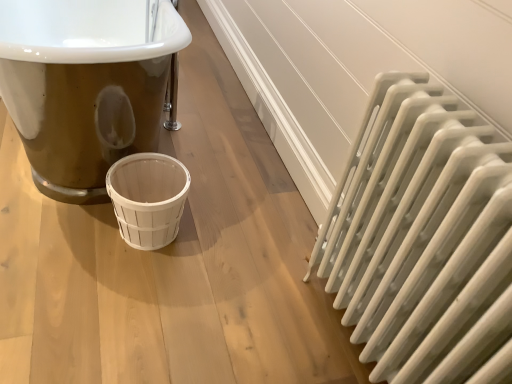
Question: Is white matte radiator at right inside or outside of white wood basket at center?

Choices:
 (A) outside
 (B) inside

Answer: (A)

Question: Is white matte radiator at right in front of or behind white wood basket at center in the image?

Choices:
 (A) behind
 (B) front

Answer: (B)

Question: From a real-world perspective, relative to white wood basket at center, is white matte radiator at right vertically above or below?

Choices:
 (A) above
 (B) below

Answer: (A)

Question: Is white wood basket at center taller or shorter than white matte radiator at right?

Choices:
 (A) short
 (B) tall

Answer: (A)

Question: From a real-world perspective, is white wood basket at center above or below white matte radiator at right?

Choices:
 (A) below
 (B) above

Answer: (A)

Question: In the image, is white wood basket at center positioned in front of or behind white matte radiator at right?

Choices:
 (A) behind
 (B) front

Answer: (A)

Question: From the image's perspective, is white wood basket at center positioned above or below white matte radiator at right?

Choices:
 (A) below
 (B) above

Answer: (B)